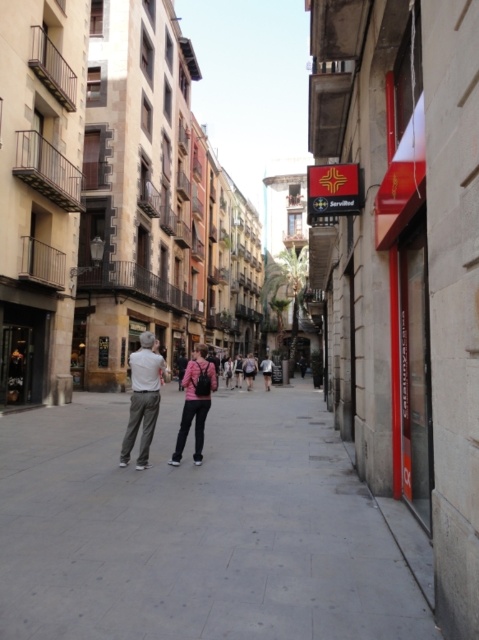
You are a delivery person trying to navigate through the narrow street. You see a pink matte jacket at center. Where exactly is the pink matte jacket located in relation to the buildings on the left side of the street?

The pink matte jacket at center is located at point [194,403], which is in the center of the image, between the buildings on the left and right sides of the street.

You are standing on the street and want to walk to the point at coordinates point (201, 392). However, there is an obstacle at point (224, 451). Will you be able to reach your destination without going around the obstacle?

Point (224, 451) is behind point (201, 392), so you can reach point (201, 392) without needing to go around the obstacle at point (224, 451).